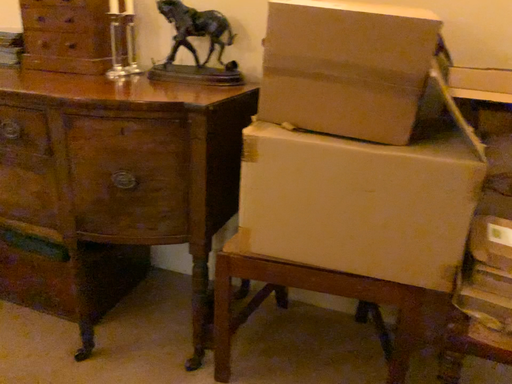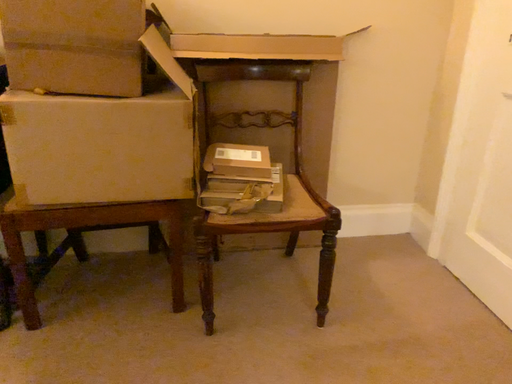
Question: How did the camera likely rotate when shooting the video?

Choices:
 (A) rotated left
 (B) rotated right

Answer: (B)